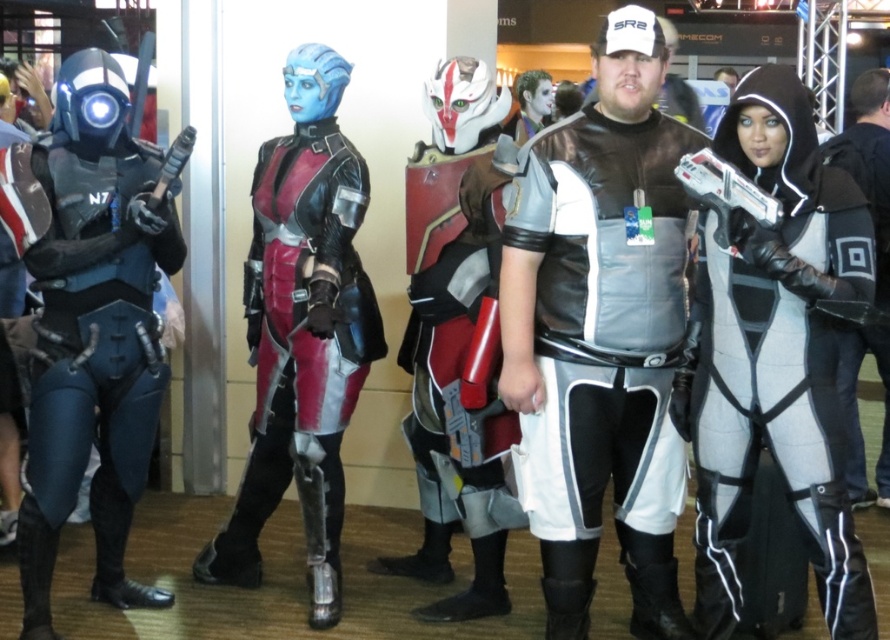
From the picture: You are standing in the center of the hall and want to find the white matte bodysuit at center. According to the coordinates provided, in which direction should you look to locate it?

The white matte bodysuit at center is located at coordinates point (775,358). Since the y coordinate is 0.872, which is closer to 1, you should look downward to locate it.

In the scene shown: You are a photographer standing at the entrance of the convention hall. You need to capture a photo that includes both the silver metallic armor at center and the white matte jacket at center. The camera you are using has a maximum focus range of 1.6 meters. Will you be able to fit both subjects into the frame without moving closer?

The distance between the silver metallic armor at center and the white matte jacket at center is 1.52 meters, which is within the camera maximum focus range of 1.6 meters. Therefore, you can capture both subjects in the frame without moving closer.